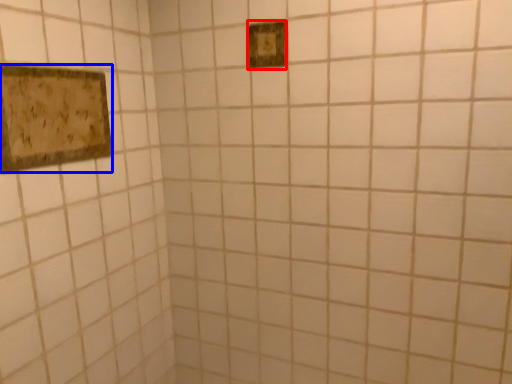
Question: Which object is closer to the camera taking this photo, light switch (highlighted by a red box) or picture frame (highlighted by a blue box)?

Choices:
 (A) light switch
 (B) picture frame

Answer: (B)